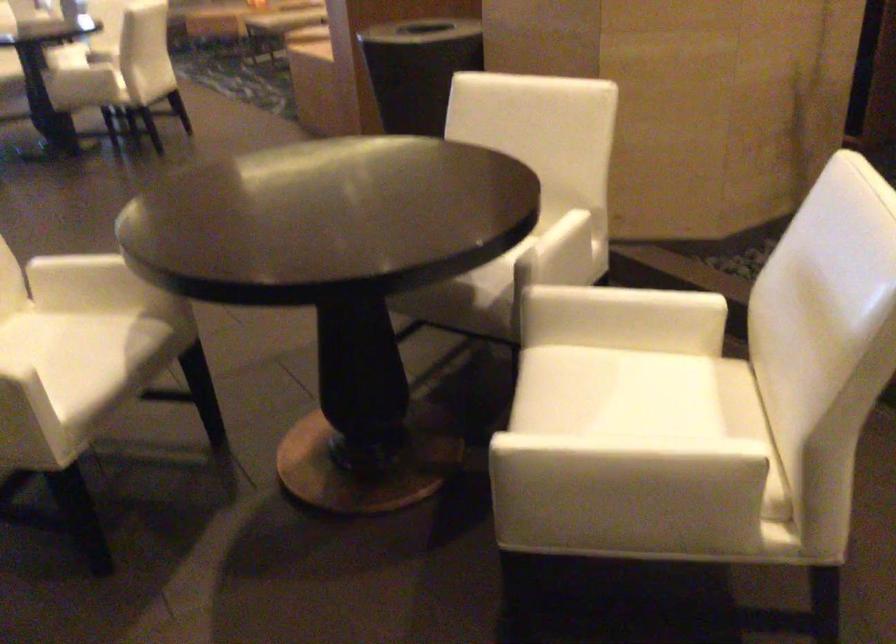
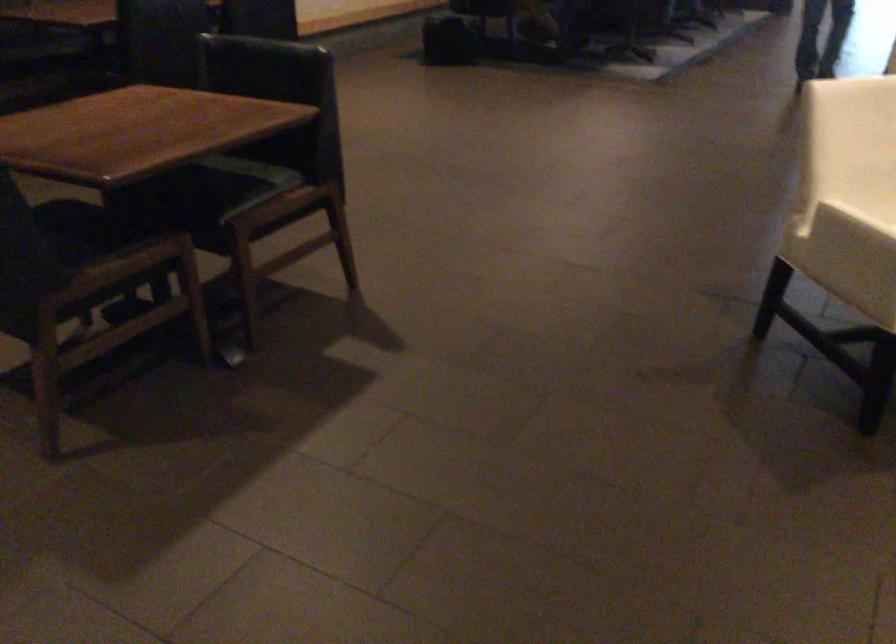
The first image is from the beginning of the video and the second image is from the end. How did the camera likely rotate when shooting the video?

A: The camera rotated toward left-down.